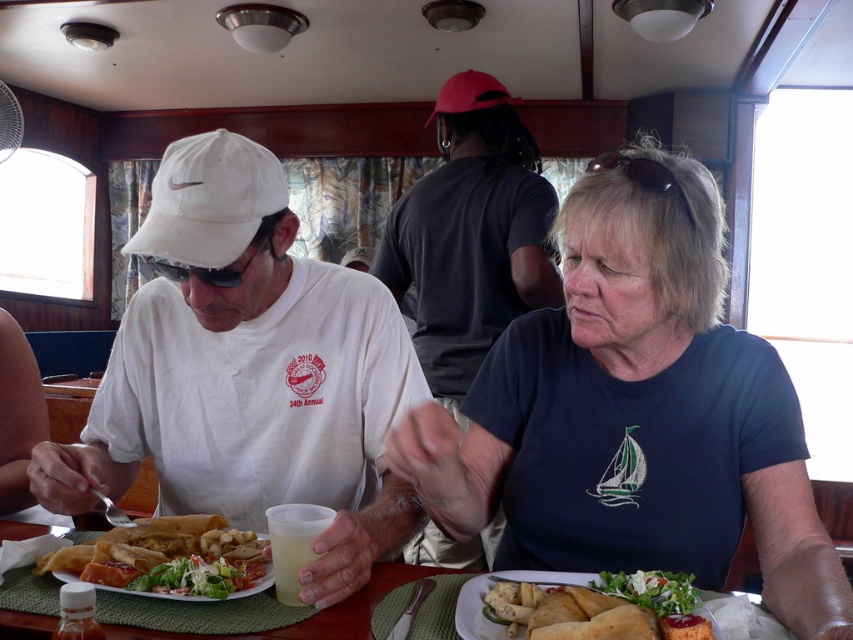
Question: Does blue cotton shirt at center appear over green placemat at lower center?

Choices:
 (A) yes
 (B) no

Answer: (A)

Question: Which point appears closest to the camera in this image?

Choices:
 (A) (613, 276)
 (B) (575, 620)

Answer: (B)

Question: Is golden crispy bread at center to the left of golden crispy bread at lower center from the viewer's perspective?

Choices:
 (A) yes
 (B) no

Answer: (A)

Question: Which point is closer to the camera taking this photo?

Choices:
 (A) (381, 593)
 (B) (570, 401)

Answer: (A)

Question: Estimate the real-world distances between objects in this image. Which object is farther from the blue cotton shirt at center?

Choices:
 (A) white matte baseball cap at upper left
 (B) dark blue t-shirt at center
 (C) golden crispy bread at center
 (D) green placemat at lower center

Answer: (D)

Question: Where is green placemat at lower center located in relation to golden crispy bread at lower center in the image?

Choices:
 (A) below
 (B) above

Answer: (A)